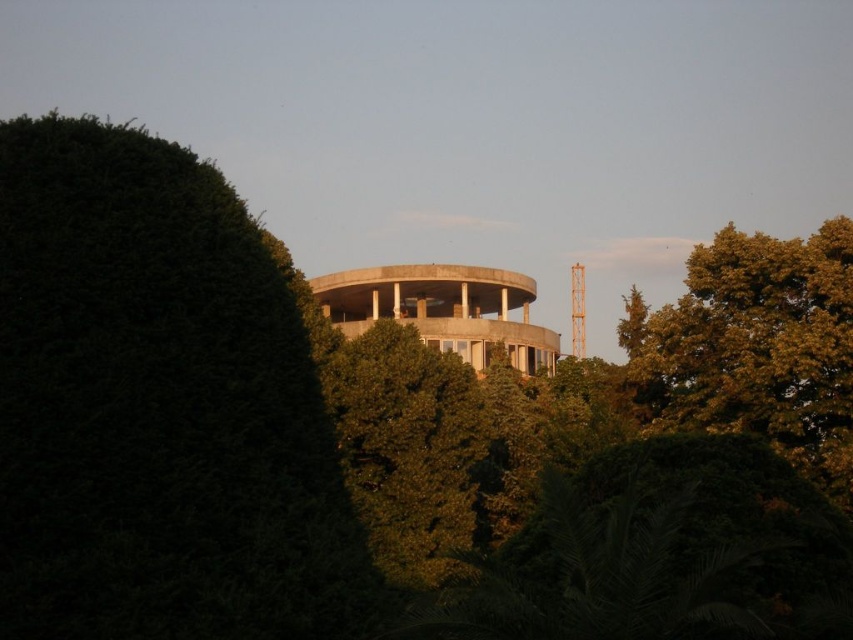
Based on the scene description, which object, the green leafy bush at upper left or the green leafy tree at upper right, is wider?

The green leafy bush at upper left might be wider than the green leafy tree at upper right according to the description.

You are standing at the camera position and want to reach the point marked at coordinate point (164, 621). If your walking speed is 1.5 meters per second, how many seconds will it take you to reach that point?

The point marked at coordinate point (164, 621) is 36.01 meters away from the camera. At a walking speed of 1.5 meters per second, it will take approximately 24.01 seconds to reach that point.